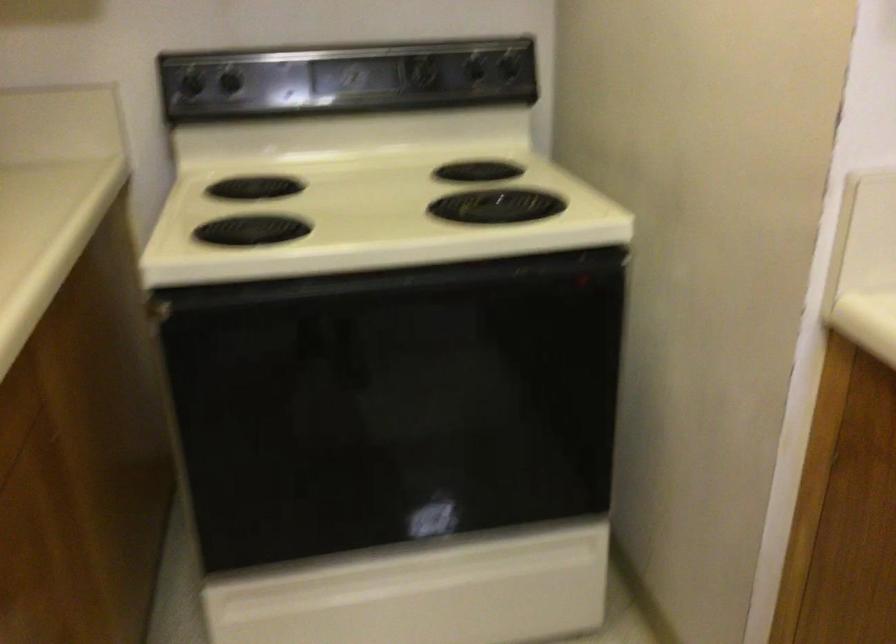
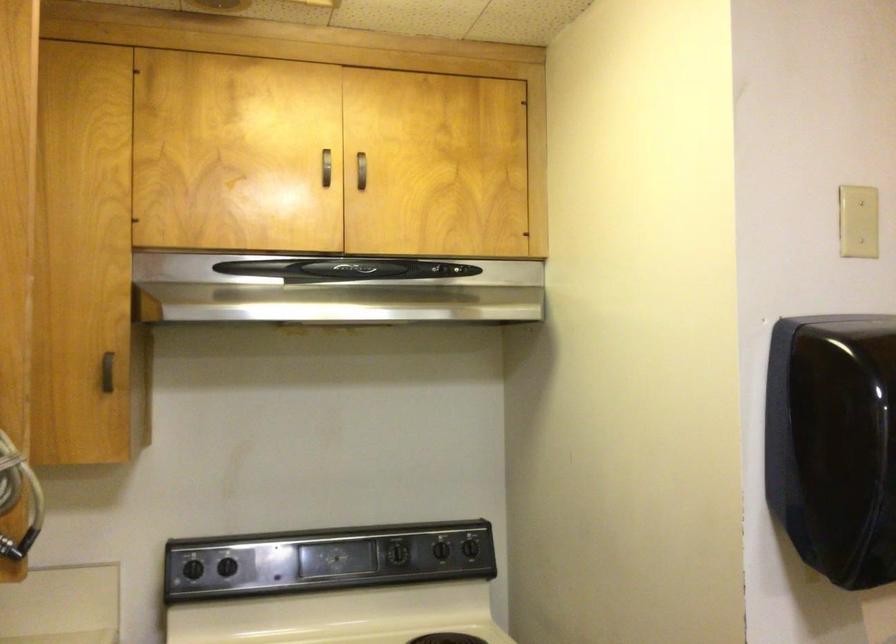
Where in the second image is the point corresponding to point (470, 71) from the first image?

(440, 549)